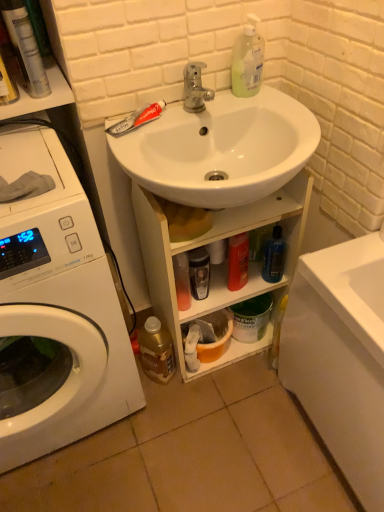
Locate an element on the screen. The width and height of the screenshot is (384, 512). free space in front of gold metallic bottle at lower left, the first bottle when ordered from bottom to top is located at coordinates (164, 417).